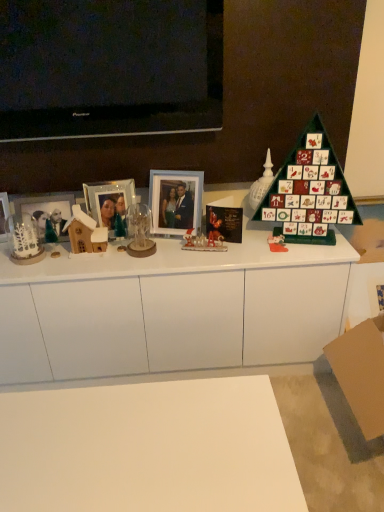
This screenshot has height=512, width=384. What do you see at coordinates (361, 373) in the screenshot? I see `brown cardboard at lower right` at bounding box center [361, 373].

Describe the element at coordinates (109, 204) in the screenshot. I see `matte glass picture frame at center left, the 2th picture frame viewed from the left` at that location.

This screenshot has width=384, height=512. Identify the location of green wooden advent calendar at right, placed as the 5th toy when sorted from left to right. (261, 183).

At what (x,y) coordinates should I click in order to perform the action: click on white glossy santa claus at center, marked as the fourth toy in a left-to-right arrangement. Please return your answer as a coordinate pair (x, y). Image resolution: width=384 pixels, height=512 pixels. Looking at the image, I should click on (202, 243).

Locate an element on the screen. The height and width of the screenshot is (512, 384). white matte desk at lower center is located at coordinates 148,448.

Locate an element on the screen. The image size is (384, 512). brown cardboard at lower right is located at coordinates (361, 373).

Is matte plastic advent calendar at right, acting as the 6th toy starting from the left, at the back of green wooden advent calendar at right, which is counted as the 2th toy, starting from the right?

No, green wooden advent calendar at right, which is counted as the 2th toy, starting from the right, is not facing the opposite direction of matte plastic advent calendar at right, acting as the 6th toy starting from the left.

From the image's perspective, is green wooden advent calendar at right, which is counted as the 2th toy, starting from the right, on top of matte plastic advent calendar at right, which appears as the first toy when viewed from the right?

Correct, green wooden advent calendar at right, which is counted as the 2th toy, starting from the right, appears higher than matte plastic advent calendar at right, which appears as the first toy when viewed from the right, in the image.

From a real-world perspective, is green wooden advent calendar at right, placed as the 5th toy when sorted from left to right, below matte plastic advent calendar at right, which appears as the first toy when viewed from the right?

Incorrect, from a real-world perspective, green wooden advent calendar at right, placed as the 5th toy when sorted from left to right, is higher than matte plastic advent calendar at right, which appears as the first toy when viewed from the right.

Can you confirm if green matte advent calendar at right is shorter than matte wooden picture frame at left, marked as the 1th picture frame in a left-to-right arrangement?

No, green matte advent calendar at right is not shorter than matte wooden picture frame at left, marked as the 1th picture frame in a left-to-right arrangement.

Can you confirm if green matte advent calendar at right is wider than matte wooden picture frame at left, the 3th picture frame from the right?

Yes, green matte advent calendar at right is wider than matte wooden picture frame at left, the 3th picture frame from the right.

Looking at this image, are green matte advent calendar at right and matte wooden picture frame at left, marked as the 1th picture frame in a left-to-right arrangement, making contact?

green matte advent calendar at right and matte wooden picture frame at left, marked as the 1th picture frame in a left-to-right arrangement, are clearly separated.

At what (x,y) coordinates should I click in order to perform the action: click on christmas tree located in front of the matte wooden picture frame at left, marked as the 1th picture frame in a left-to-right arrangement. Please return your answer as a coordinate pair (x, y). This screenshot has height=512, width=384. Looking at the image, I should click on [x=309, y=191].

Consider the image. Is matte plastic advent calendar at right, which appears as the first toy when viewed from the right, placed right next to white glossy cabinet at center?

No, matte plastic advent calendar at right, which appears as the first toy when viewed from the right, is not with white glossy cabinet at center.

In the scene shown: Is matte plastic advent calendar at right, which appears as the first toy when viewed from the right, located outside white glossy cabinet at center?

No, matte plastic advent calendar at right, which appears as the first toy when viewed from the right, is not entirely external to white glossy cabinet at center.

Does matte plastic advent calendar at right, acting as the 6th toy starting from the left, have a lesser height compared to white glossy cabinet at center?

Indeed, matte plastic advent calendar at right, acting as the 6th toy starting from the left, has a lesser height compared to white glossy cabinet at center.

In terms of width, does white matte desk at lower center look wider or thinner when compared to white glossy santa claus at center, marked as the fourth toy in a left-to-right arrangement?

Clearly, white matte desk at lower center has more width compared to white glossy santa claus at center, marked as the fourth toy in a left-to-right arrangement.

Is white matte desk at lower center directly adjacent to white glossy santa claus at center, marked as the fourth toy in a left-to-right arrangement?

There is a gap between white matte desk at lower center and white glossy santa claus at center, marked as the fourth toy in a left-to-right arrangement.

Which object is further away from the camera, white matte desk at lower center or white glossy santa claus at center, the 3th toy in the right-to-left sequence?

white glossy santa claus at center, the 3th toy in the right-to-left sequence, is more distant.

I want to click on desk on the left of the white glossy santa claus at center, the 3th toy in the right-to-left sequence, so click(148, 448).

Does point (153, 242) come in front of point (115, 195)?

Yes, it is.

From the image's perspective, which is above, clear glass ornament at center, arranged as the third toy when viewed from the left, or matte glass picture frame at center left, the 2th picture frame viewed from the left?

matte glass picture frame at center left, the 2th picture frame viewed from the left, is shown above in the image.

Based on the photo, is clear glass ornament at center, arranged as the third toy when viewed from the left, touching matte glass picture frame at center left, the 2th picture frame from the right?

They are not placed beside each other.

How different are the orientations of clear glass ornament at center, the fourth toy viewed from the right, and matte glass picture frame at center left, the 2th picture frame from the right, in degrees?

clear glass ornament at center, the fourth toy viewed from the right, and matte glass picture frame at center left, the 2th picture frame from the right, are facing 16.2 degrees away from each other.

From the image's perspective, which is above, black paper christmas card at center or wooden house at left, which appears as the 2th toy when viewed from the left?

black paper christmas card at center appears higher in the image.

Find the location of a particular element. The height and width of the screenshot is (512, 384). the 3rd toy counting from the left of the black paper christmas card at center is located at coordinates (85, 233).

Is point (238, 217) in front of point (98, 246)?

No, (238, 217) is further to viewer.

Relative to wooden house at left, which appears as the 5th toy when viewed from the right, is black paper christmas card at center in front or behind?

black paper christmas card at center is behind wooden house at left, which appears as the 5th toy when viewed from the right.

Based on their sizes in the image, would you say green matte advent calendar at right is bigger or smaller than matte plastic advent calendar at right, acting as the 6th toy starting from the left?

green matte advent calendar at right is bigger than matte plastic advent calendar at right, acting as the 6th toy starting from the left.

Is green matte advent calendar at right in front of or behind matte plastic advent calendar at right, acting as the 6th toy starting from the left, in the image?

In the image, green matte advent calendar at right appears in front of matte plastic advent calendar at right, acting as the 6th toy starting from the left.

Based on the photo, would you say green matte advent calendar at right is a long distance from matte plastic advent calendar at right, acting as the 6th toy starting from the left?

That's not correct — green matte advent calendar at right is a little close to matte plastic advent calendar at right, acting as the 6th toy starting from the left.

Which object is wider, green matte advent calendar at right or matte plastic advent calendar at right, acting as the 6th toy starting from the left?

green matte advent calendar at right.

Find the location of a particular element. toy on the right of green wooden advent calendar at right, placed as the 5th toy when sorted from left to right is located at coordinates (277, 243).

Identify the location of christmas tree that appears in front of the matte wooden picture frame at left, the 3th picture frame from the right. (309, 191).

Considering their positions, is white frosted glass jar at left, which is counted as the first toy, starting from the left, positioned further to white glossy cabinet at center than wooden house at left, which appears as the 5th toy when viewed from the right?

Based on the image, white frosted glass jar at left, which is counted as the first toy, starting from the left, appears to be further to white glossy cabinet at center.

Considering their positions, is wooden house at left, which appears as the 2th toy when viewed from the left, positioned further to brown cardboard at lower right than green matte advent calendar at right?

Based on the image, wooden house at left, which appears as the 2th toy when viewed from the left, appears to be further to brown cardboard at lower right.

Considering their positions, is brown cardboard at lower right positioned closer to green wooden advent calendar at right, placed as the 5th toy when sorted from left to right, than blue wooden picture frame at center, which is the 3th picture frame in left-to-right order?

The object closer to green wooden advent calendar at right, placed as the 5th toy when sorted from left to right, is blue wooden picture frame at center, which is the 3th picture frame in left-to-right order.

Based on their spatial positions, is white glossy santa claus at center, the 3th toy in the right-to-left sequence, or matte plastic advent calendar at right, acting as the 6th toy starting from the left, closer to clear glass ornament at center, arranged as the third toy when viewed from the left?

Based on the image, white glossy santa claus at center, the 3th toy in the right-to-left sequence, appears to be nearer to clear glass ornament at center, arranged as the third toy when viewed from the left.

When comparing their distances from matte glass picture frame at center left, the 2th picture frame from the right, does wooden house at left, which appears as the 2th toy when viewed from the left, or white frosted glass jar at left, the sixth toy in the right-to-left sequence, seem closer?

wooden house at left, which appears as the 2th toy when viewed from the left, lies closer to matte glass picture frame at center left, the 2th picture frame from the right, than the other object.

Based on their spatial positions, is black paper christmas card at center or green matte advent calendar at right closer to white matte desk at lower center?

The object closer to white matte desk at lower center is black paper christmas card at center.

Looking at the image, which one is located further to matte glass picture frame at center left, the 2th picture frame from the right, white glossy cabinet at center or white frosted glass jar at left, which is counted as the first toy, starting from the left?

white glossy cabinet at center is positioned further to the anchor matte glass picture frame at center left, the 2th picture frame from the right.

From the image, which object appears to be farther from white glossy cabinet at center, blue wooden picture frame at center, which is the 3th picture frame in left-to-right order, or wooden house at left, which appears as the 2th toy when viewed from the left?

wooden house at left, which appears as the 2th toy when viewed from the left.

What are the coordinates of `christmas tree between matte glass picture frame at center left, the 2th picture frame viewed from the left, and brown cardboard at lower right` in the screenshot? It's located at (309, 191).

Locate an element on the screen. The height and width of the screenshot is (512, 384). cabinetry between white frosted glass jar at left, the sixth toy in the right-to-left sequence, and black paper christmas card at center is located at coordinates (169, 310).

The height and width of the screenshot is (512, 384). What are the coordinates of `picture frame between clear glass ornament at center, arranged as the third toy when viewed from the left, and green matte advent calendar at right` in the screenshot? It's located at (175, 201).

Image resolution: width=384 pixels, height=512 pixels. In order to click on picture frame between clear glass ornament at center, arranged as the third toy when viewed from the left, and black paper christmas card at center, in the horizontal direction in this screenshot , I will do `click(175, 201)`.